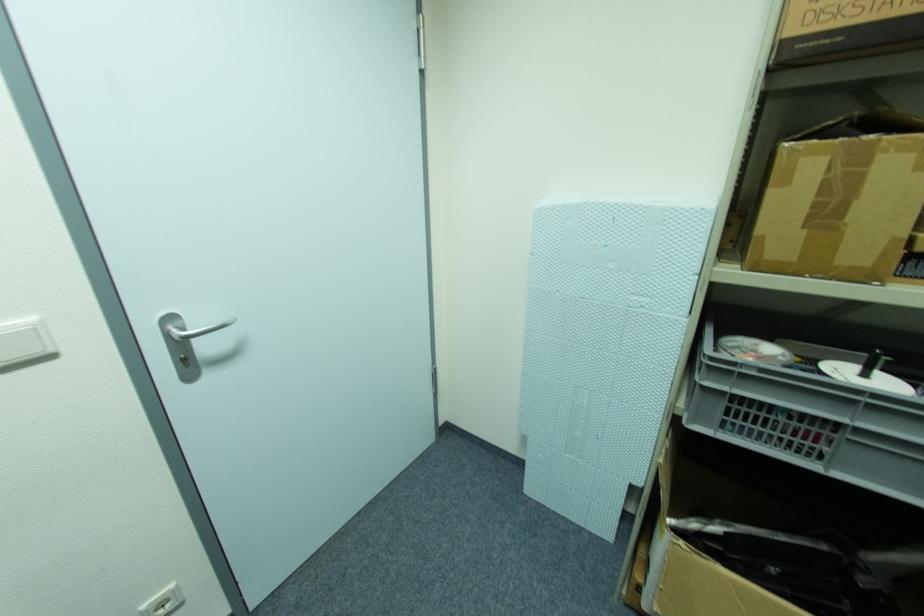
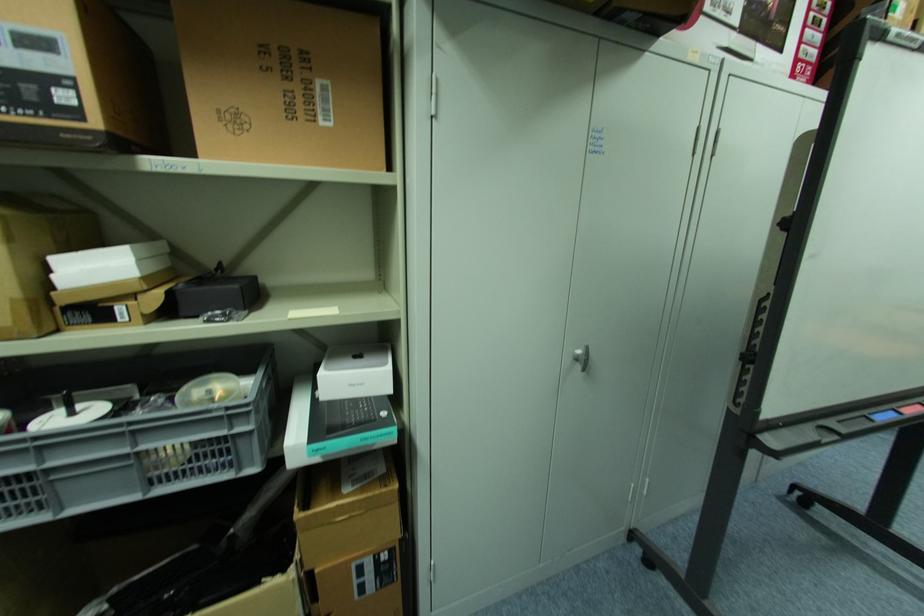
Question: Based on the continuous images, in which direction is the camera rotating? Reply with the corresponding letter.

Choices:
 (A) Left
 (B) Right
 (C) Up
 (D) Down

Answer: (B)